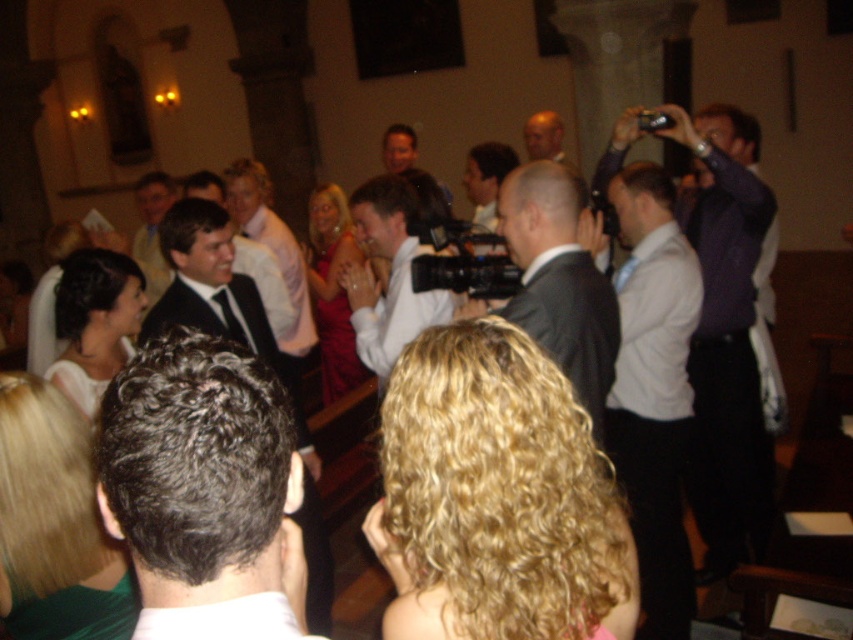
Question: Which point appears farthest from the camera in this image?

Choices:
 (A) (756, 493)
 (B) (395, 300)
 (C) (674, 237)

Answer: (A)

Question: Which is farther from the white satin dress at center?

Choices:
 (A) smooth brown hair at center
 (B) shiny red dress at center
 (C) white glossy camera at center

Answer: (B)

Question: Is white satin dress at center below smooth brown hair at center?

Choices:
 (A) no
 (B) yes

Answer: (B)

Question: Which is nearer to the light blue shirt at center?

Choices:
 (A) matte black camera at center
 (B) dark gray hair at center
 (C) white shirt at center
 (D) curly blonde hair at center

Answer: (C)

Question: Can you confirm if curly blonde hair at center is smaller than smooth bald head at center?

Choices:
 (A) yes
 (B) no

Answer: (B)

Question: Is dark gray hair at center in front of white shirt at center?

Choices:
 (A) yes
 (B) no

Answer: (A)